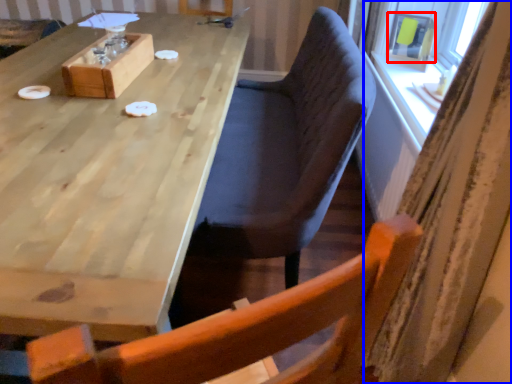
Question: Which point is further to the camera, window screen (highlighted by a red box) or curtain (highlighted by a blue box)?

Choices:
 (A) window screen
 (B) curtain

Answer: (A)